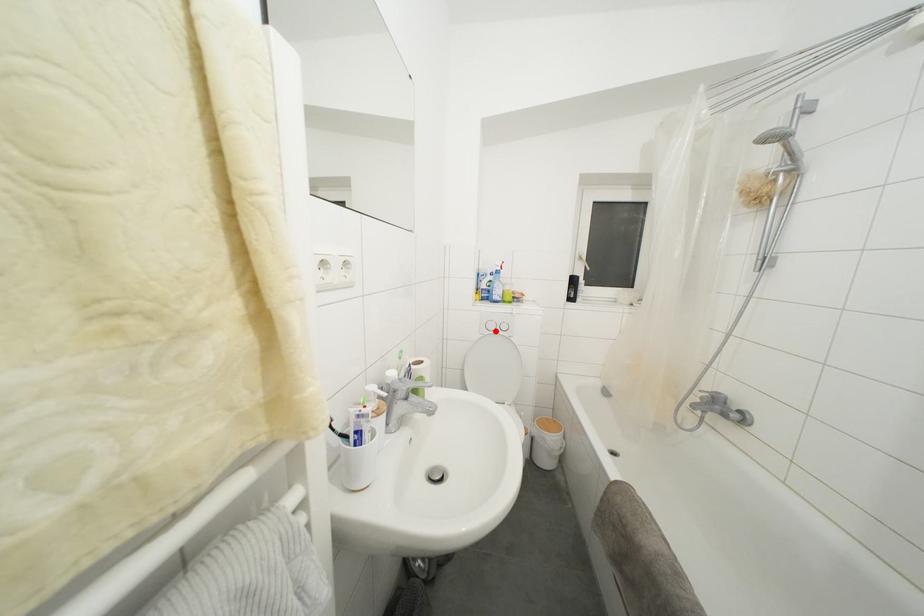
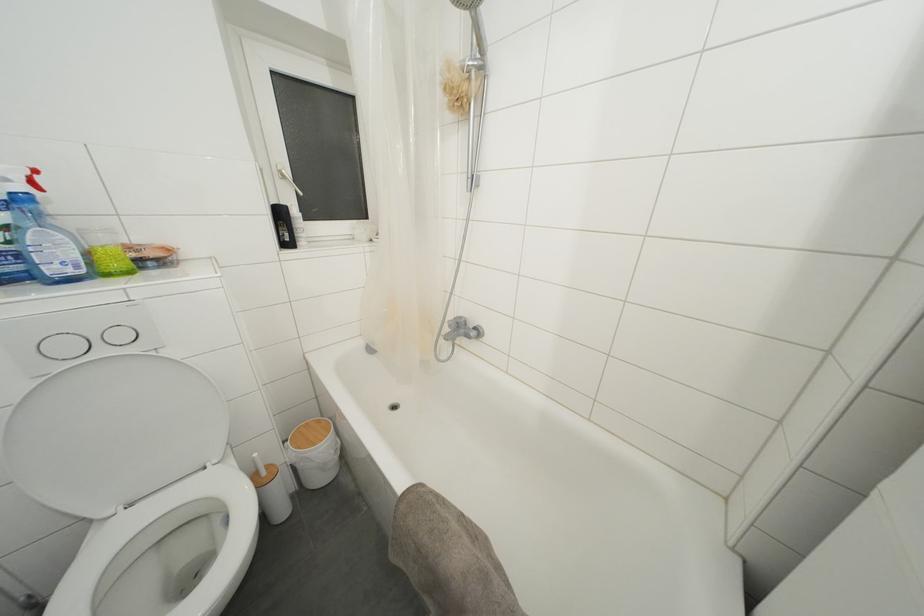
Find the pixel in the second image that matches the highlighted location in the first image.

(71, 352)